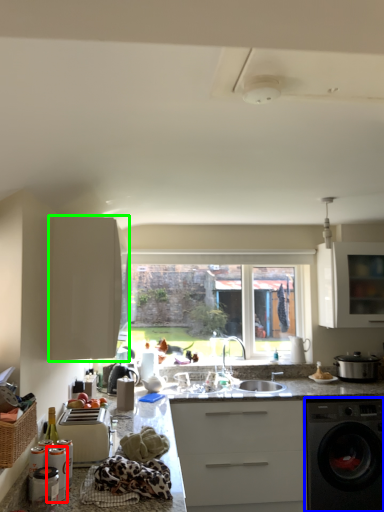
Question: Based on their relative distances, which object is nearer to appliance (highlighted by a red box)? Choose from home appliance (highlighted by a blue box) and cabinetry (highlighted by a green box).

Choices:
 (A) home appliance
 (B) cabinetry

Answer: (B)